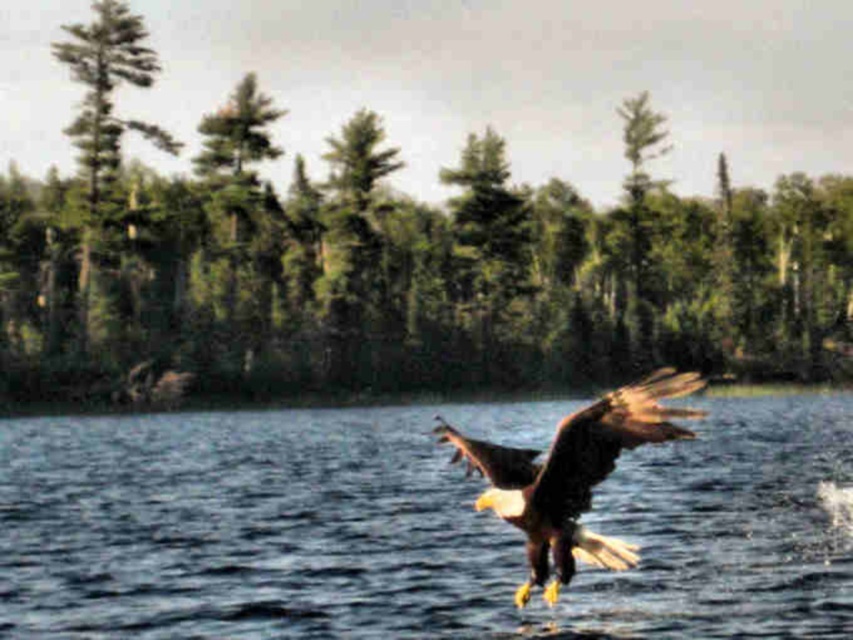
Is green textured tree at center further to the viewer compared to blue water at center?

Yes, green textured tree at center is further from the viewer.

Describe the element at coordinates (392, 260) in the screenshot. I see `green textured tree at center` at that location.

Identify the location of green textured tree at center. Image resolution: width=853 pixels, height=640 pixels. (392, 260).

Who is more forward, (796, 440) or (502, 451)?

Positioned in front is point (502, 451).

Which is behind, point (276, 468) or point (508, 508)?

The point (276, 468) is more distant.

Does point (434, 410) lie in front of point (610, 454)?

No, it is behind (610, 454).

At what (x,y) coordinates should I click in order to perform the action: click on blue water at center. Please return your answer as a coordinate pair (x, y). The image size is (853, 640). Looking at the image, I should click on (415, 528).

Which is more to the right, green textured tree at center or brown feathered eagle at center?

Positioned to the right is brown feathered eagle at center.

Locate an element on the screen. The height and width of the screenshot is (640, 853). green textured tree at center is located at coordinates click(392, 260).